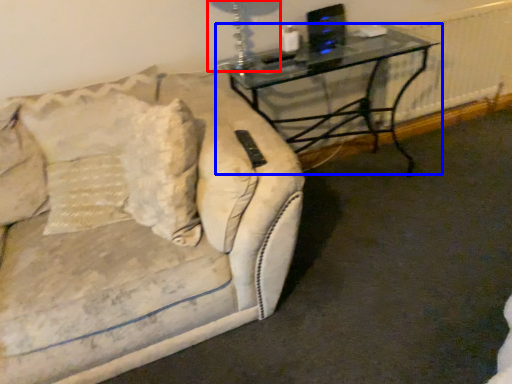
Question: Which object is further to the camera taking this photo, table lamp (highlighted by a red box) or table (highlighted by a blue box)?

Choices:
 (A) table lamp
 (B) table

Answer: (B)